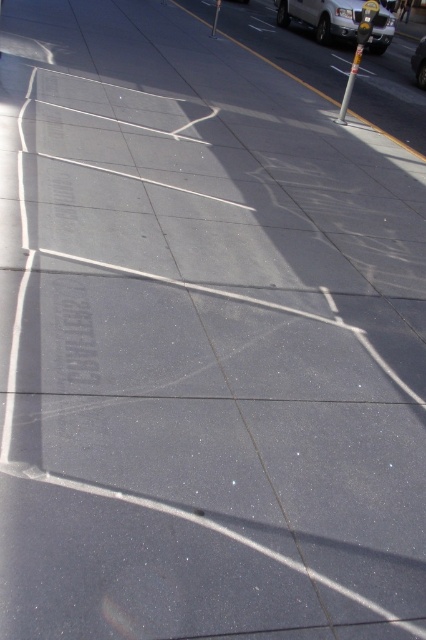
You are standing on the sidewalk and notice a white glossy van at upper right. If you were to walk straight ahead, would you encounter the van before reaching the end of the sidewalk?

The white glossy van at upper right is located at point (322, 17), which is near the edge of the scene. Since the van is positioned at the upper right corner, walking straight ahead might not lead you directly toward it. The exact path depends on the sidewalk layout, but based on its position, you might reach the end of the sidewalk before encountering the van.

You are a delivery person who needs to park your 2.5 meter wide delivery truck between the white glossy van at upper right and the metallic silver car at upper right. Can you fit your truck there?

The distance between the white glossy van at upper right and the metallic silver car at upper right is 3.38 meters. Since your delivery truck is 2.5 meters wide, it can fit in the space between them as there is enough width available.